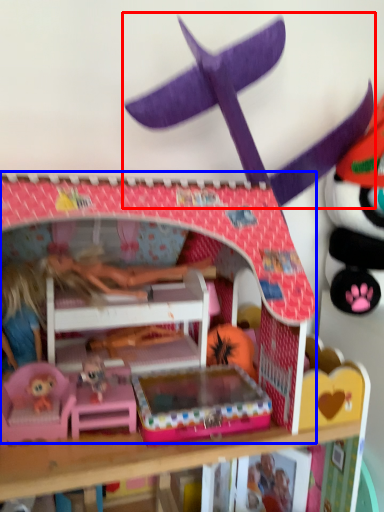
Question: Which object appears closest to the camera in this image, toy (highlighted by a red box) or bunk bed (highlighted by a blue box)?

Choices:
 (A) toy
 (B) bunk bed

Answer: (B)